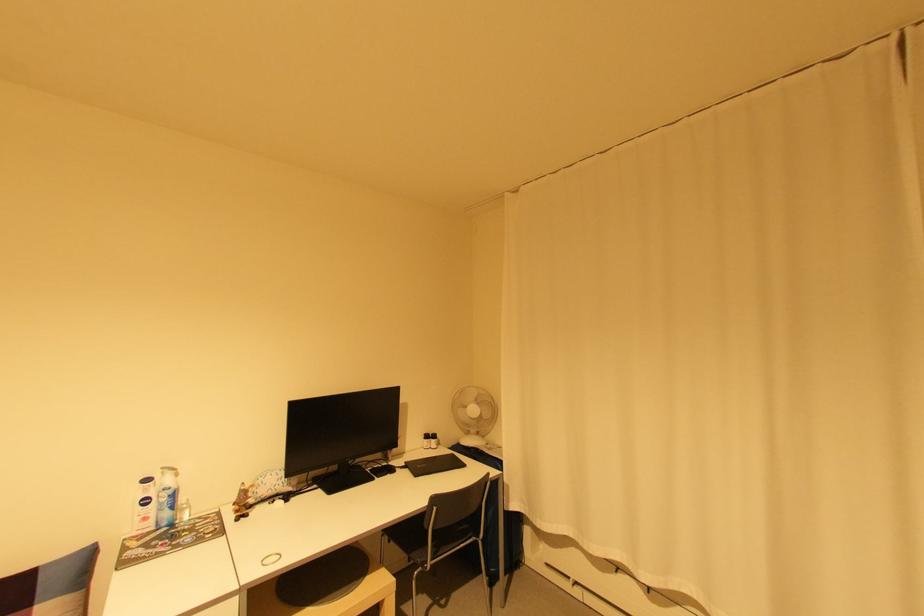
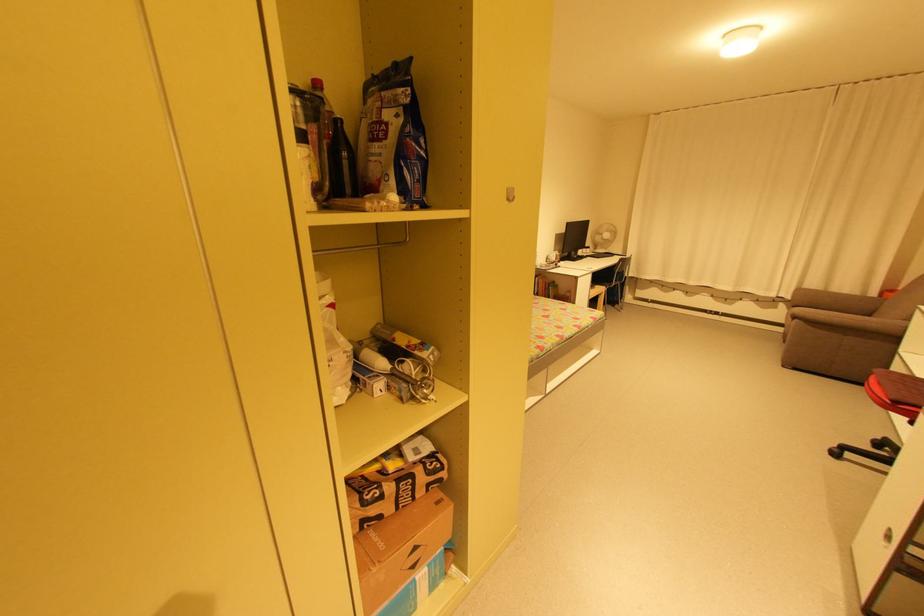
In the second image, find the point that corresponds to point 438,440 in the first image.

(592, 249)